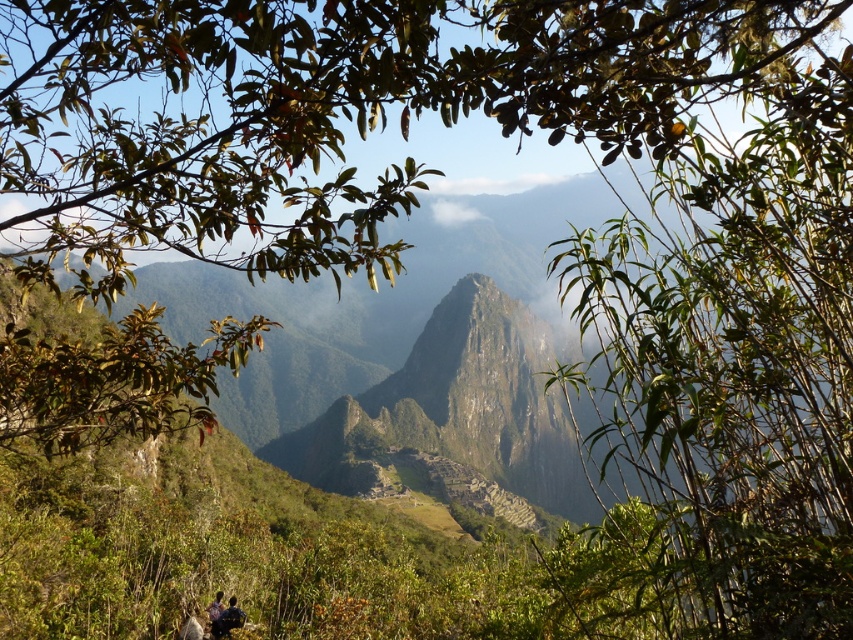
Is dark blue shirt at lower left further to the viewer compared to dark brown hair at lower left?

Yes, it is behind dark brown hair at lower left.

At what (x,y) coordinates should I click in order to perform the action: click on dark blue shirt at lower left. Please return your answer as a coordinate pair (x, y). The height and width of the screenshot is (640, 853). Looking at the image, I should click on (227, 620).

Who is more distant from viewer, (223, 628) or (194, 616)?

Positioned behind is point (194, 616).

The image size is (853, 640). Find the location of `dark blue shirt at lower left`. dark blue shirt at lower left is located at coordinates (227, 620).